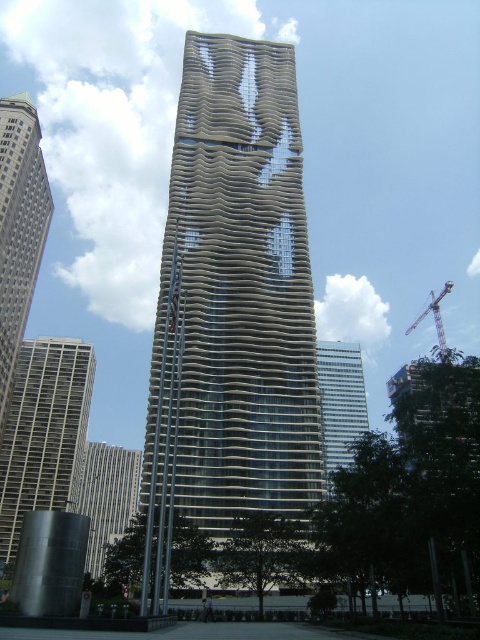
Question: Which of the following is the closest to the observer?

Choices:
 (A) (259, 202)
 (B) (359, 436)
 (C) (87, 500)
 (D) (442, 346)

Answer: (A)

Question: Which point is closer to the camera?

Choices:
 (A) white glass building at center
 (B) matte gray skyscraper at left

Answer: (A)

Question: Where is gray concrete building at left located in relation to metallic gray crane at right in the image?

Choices:
 (A) left
 (B) right

Answer: (A)

Question: Is brown textured building at center to the left of gray concrete building at left from the viewer's perspective?

Choices:
 (A) no
 (B) yes

Answer: (A)

Question: Estimate the real-world distances between objects in this image. Which object is closer to the gray concrete building at left?

Choices:
 (A) white glass building at center
 (B) gray concrete building at center
 (C) brown textured building at center
 (D) matte gray skyscraper at left

Answer: (B)

Question: Is gray concrete building at left thinner than gray concrete building at center?

Choices:
 (A) no
 (B) yes

Answer: (B)